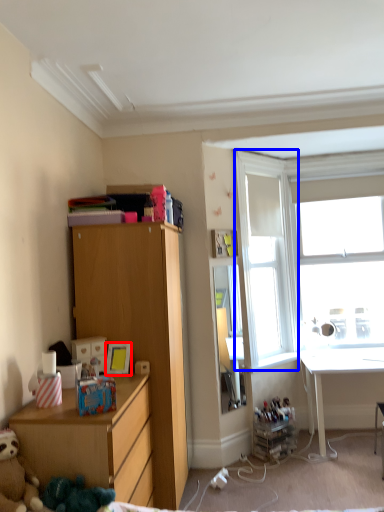
Question: Which of the following is the closest to the observer, picture frame (highlighted by a red box) or window screen (highlighted by a blue box)?

Choices:
 (A) picture frame
 (B) window screen

Answer: (A)